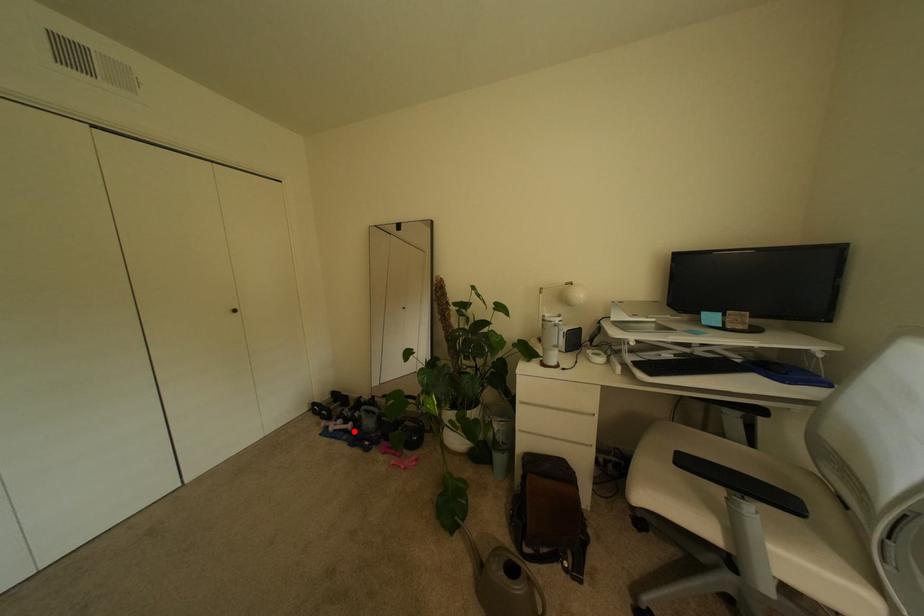
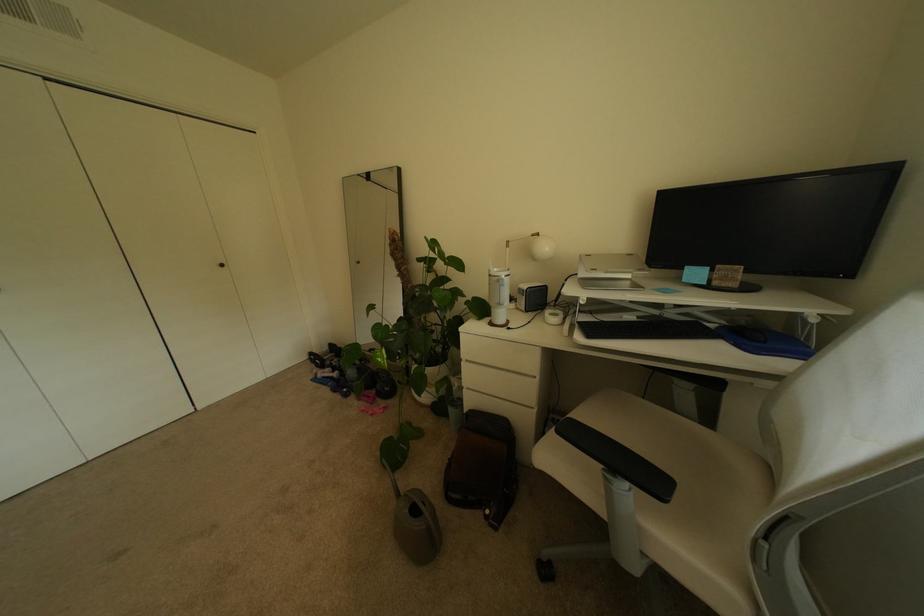
The point at the highlighted location is marked in the first image. Where is the corresponding point in the second image?

(341, 379)